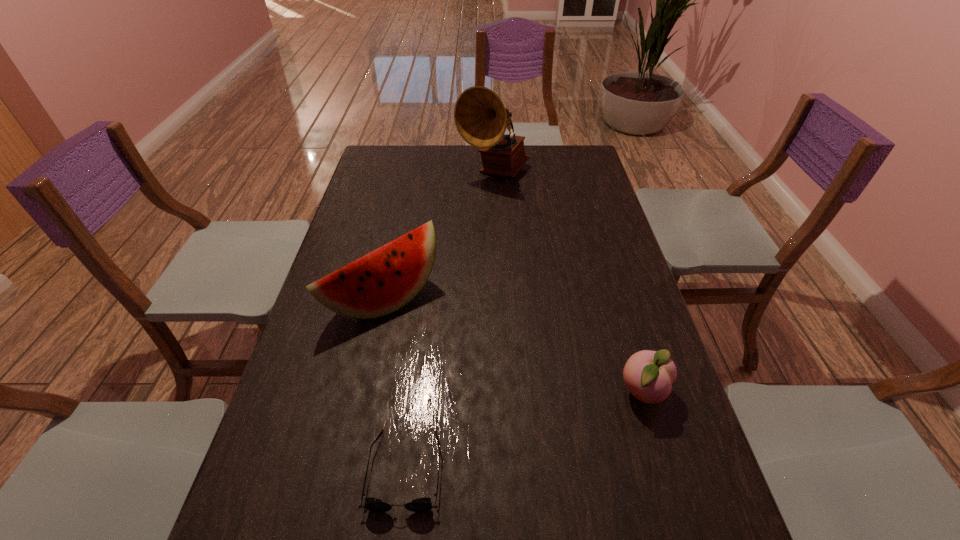
The height and width of the screenshot is (540, 960). Find the location of `the shortest object`. the shortest object is located at coordinates (424, 504).

Locate an element on the screen. the nearest object is located at coordinates (424, 504).

Find the location of a particular element. This screenshot has height=540, width=960. peach is located at coordinates (648, 375).

The height and width of the screenshot is (540, 960). In order to click on the rightmost object in this screenshot , I will do coord(648,375).

Identify the location of the third shortest object. Image resolution: width=960 pixels, height=540 pixels. (386, 279).

Image resolution: width=960 pixels, height=540 pixels. Identify the location of watermelon. (386, 279).

Where is `the tallest object`? the tallest object is located at coordinates (481, 118).

At what (x,y) coordinates should I click in order to perform the action: click on phonograph record. Please return your answer as a coordinate pair (x, y). This screenshot has width=960, height=540. Looking at the image, I should click on (481, 118).

Identify the location of vacant position located 0.120m on the front of the peach. The image size is (960, 540). (667, 471).

I want to click on free space located on the outer rind of the third nearest object, so click(x=469, y=369).